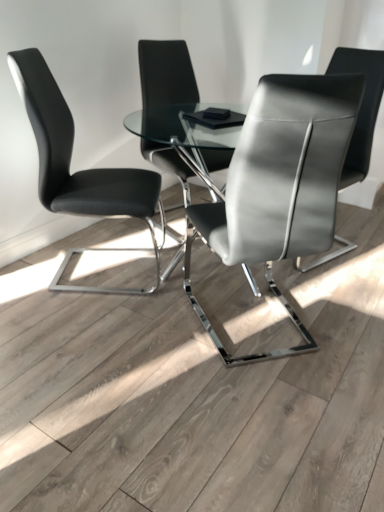
I want to click on vacant area that lies in front of satin black chair at center, the 4th chair positioned from the left, so click(338, 287).